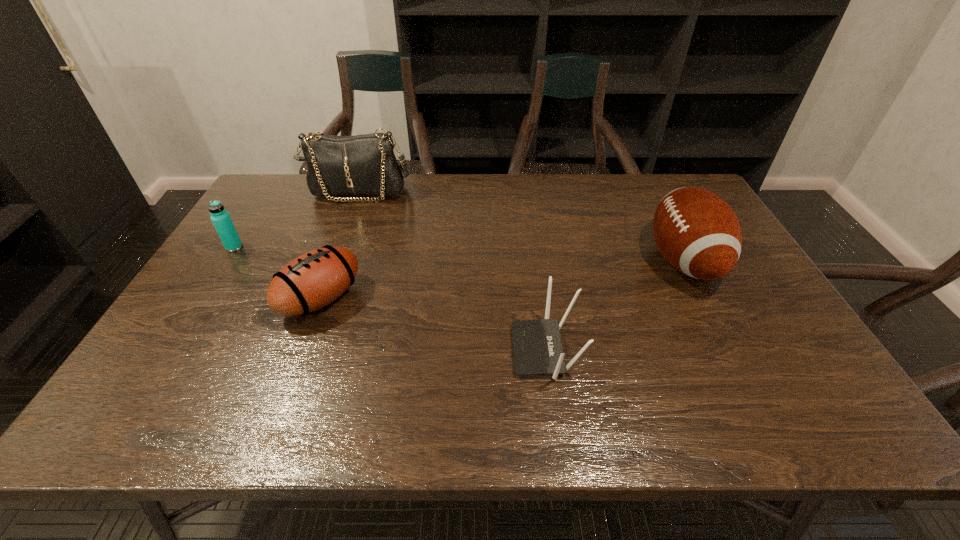
The height and width of the screenshot is (540, 960). I want to click on handbag, so click(362, 165).

At what (x,y) coordinates should I click in order to perform the action: click on the taller football (American). Please return your answer as a coordinate pair (x, y). Image resolution: width=960 pixels, height=540 pixels. Looking at the image, I should click on (697, 232).

I want to click on the rightmost object, so click(697, 232).

Identify the location of the third tallest object. This screenshot has width=960, height=540. (220, 218).

Identify the location of water bottle. The height and width of the screenshot is (540, 960). (220, 218).

This screenshot has width=960, height=540. Find the location of `the left football (American)`. the left football (American) is located at coordinates (313, 280).

This screenshot has height=540, width=960. I want to click on router, so click(x=537, y=347).

Where is `vacant space located at the front of the handbag with chain and zipper`? The image size is (960, 540). vacant space located at the front of the handbag with chain and zipper is located at coordinates click(x=343, y=236).

The height and width of the screenshot is (540, 960). Identify the location of vacant space positioned 0.400m on the laces of the right football (American). (508, 260).

At what (x,y) coordinates should I click in order to perform the action: click on free space located 0.220m on the laces of the right football (American). Please return your answer as a coordinate pair (x, y). The height and width of the screenshot is (540, 960). Looking at the image, I should click on (571, 260).